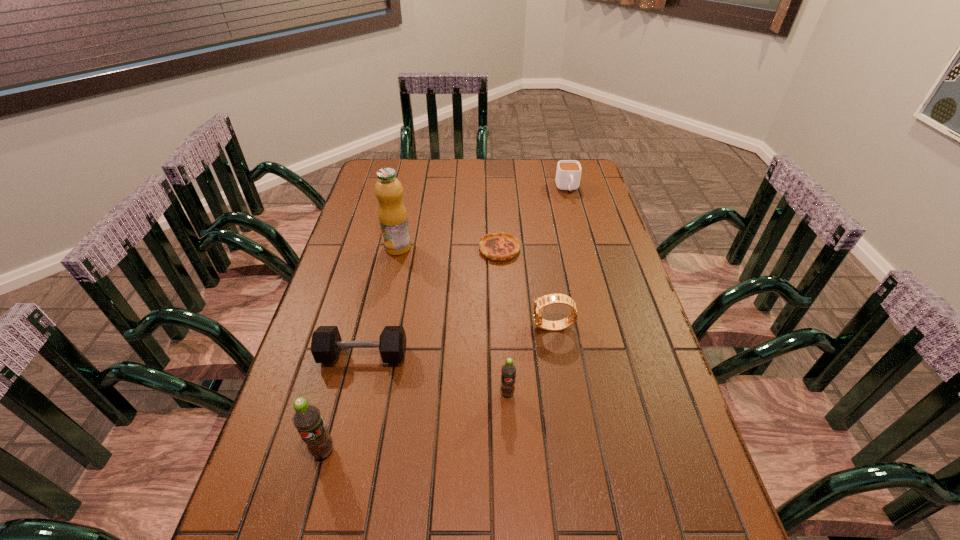
I want to click on empty space between the nearer soda and the farther soda, so coord(416,422).

Identify the location of object that is the sixth closest to the taller soda. (568, 174).

This screenshot has height=540, width=960. What are the coordinates of `object that is the sixth closest to the shorter soda` in the screenshot? It's located at (568, 174).

Locate an element on the screen. The height and width of the screenshot is (540, 960). free space that satisfies the following two spatial constraints: 1. on the face of the sixth object from left to right; 2. on the front label of the farther soda is located at coordinates (564, 393).

Identify the location of vacant space that satisfies the following two spatial constraints: 1. on the side with the handle of the farthest object; 2. on the face of the fourth farthest object. This screenshot has height=540, width=960. click(x=605, y=327).

Where is `free space that satisfies the following two spatial constraints: 1. on the front label of the tallest object; 2. on the right side of the quiche`? Image resolution: width=960 pixels, height=540 pixels. free space that satisfies the following two spatial constraints: 1. on the front label of the tallest object; 2. on the right side of the quiche is located at coordinates (397, 249).